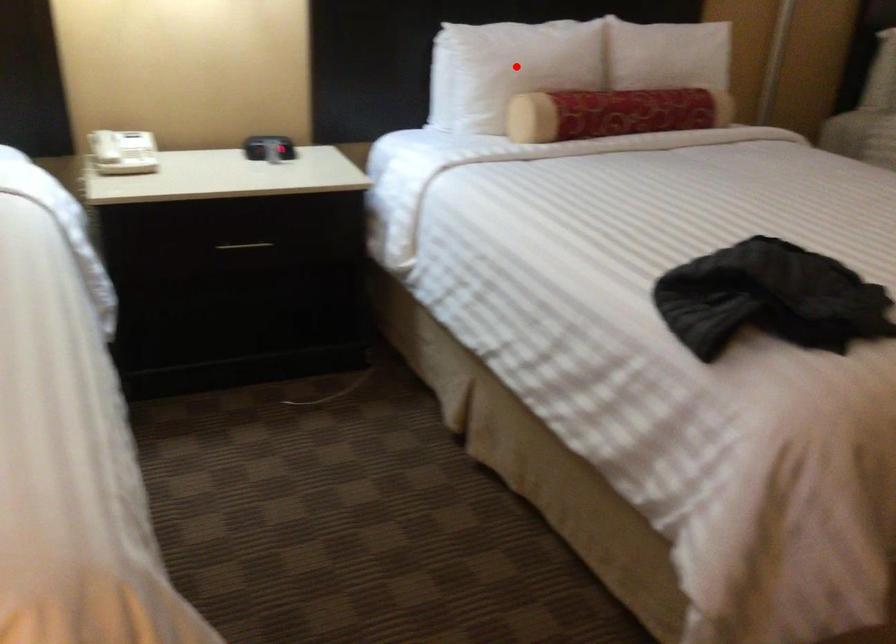
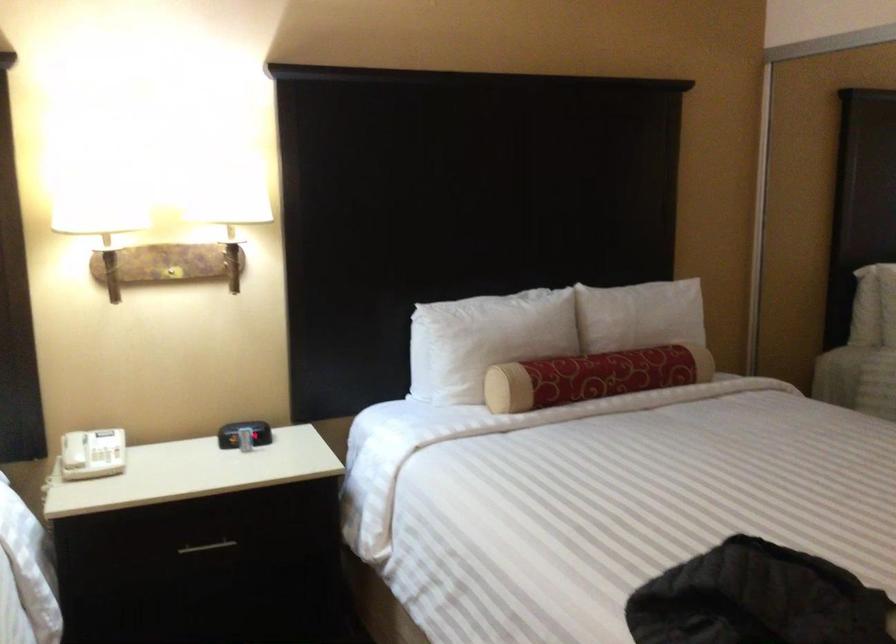
Where in the second image is the point corresponding to the highlighted location from the first image?

(485, 339)